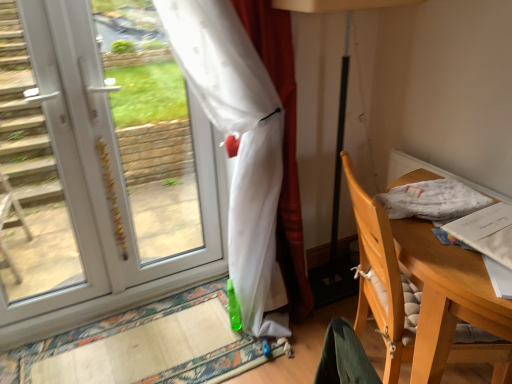
Question: In the image, is white fabric at right positioned in front of or behind white plastic door at left?

Choices:
 (A) behind
 (B) front

Answer: (B)

Question: Would you say white fabric at right is inside or outside white plastic door at left?

Choices:
 (A) inside
 (B) outside

Answer: (B)

Question: Considering the real-world distances, which object is closest to the white plastic door at left?

Choices:
 (A) white plastic door at left
 (B) carpeted mat at lower left
 (C) white fabric at right
 (D) wooden chair at right
 (E) translucent white curtain at left

Answer: (A)

Question: Considering the real-world distances, which object is closest to the white plastic door at left?

Choices:
 (A) translucent white curtain at left
 (B) white fabric at right
 (C) carpeted mat at lower left
 (D) wooden chair at right
 (E) white plastic door at left

Answer: (E)